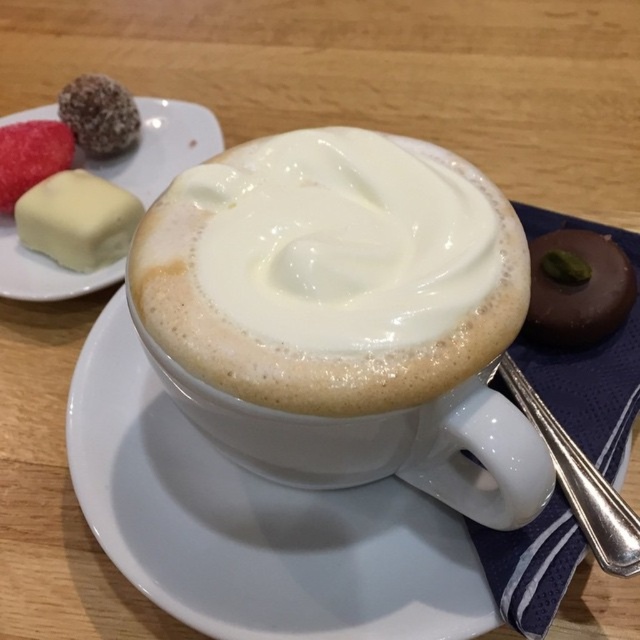
Does white matte plate at upper left have a lesser width compared to chocolate-coated ball at upper left?

Incorrect, white matte plate at upper left's width is not less than chocolate-coated ball at upper left's.

Is white matte plate at upper left closer to the viewer compared to chocolate-coated ball at upper left?

Yes, white matte plate at upper left is closer to the viewer.

Between point (13, 291) and point (92, 106), which one is positioned behind?

Point (92, 106)

I want to click on white matte plate at upper left, so click(x=163, y=147).

Which of these two, white matte plate at upper left or white creamy cube at upper left, stands shorter?

Standing shorter between the two is white creamy cube at upper left.

Who is more forward, (157, 193) or (22, 243)?

Point (22, 243) is more forward.

This screenshot has height=640, width=640. What are the coordinates of `white matte plate at upper left` in the screenshot? It's located at (163, 147).

Does white creamy cube at upper left have a lesser height compared to chocolate-coated ball at upper left?

Incorrect, white creamy cube at upper left's height does not fall short of chocolate-coated ball at upper left's.

Between white creamy cube at upper left and chocolate-coated ball at upper left, which one has less height?

With less height is chocolate-coated ball at upper left.

I want to click on white creamy cube at upper left, so click(x=77, y=220).

Identify the location of white creamy cube at upper left. (77, 220).